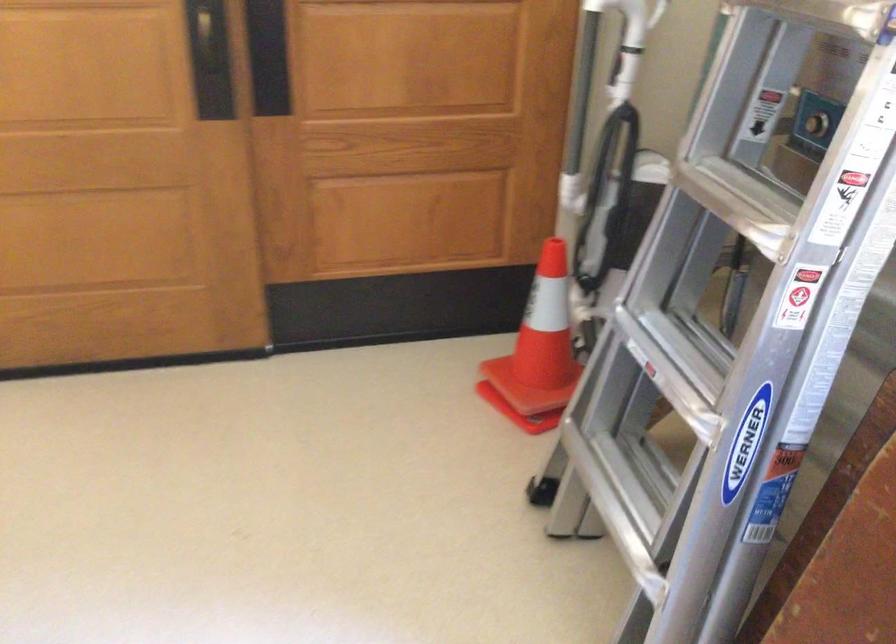
The height and width of the screenshot is (644, 896). Identify the location of silver ladder rung. (831, 431).